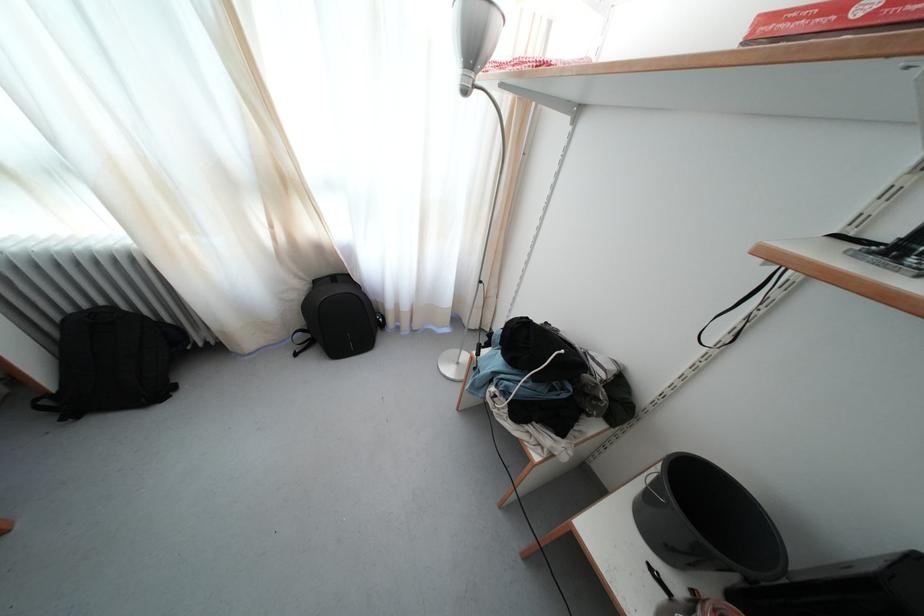
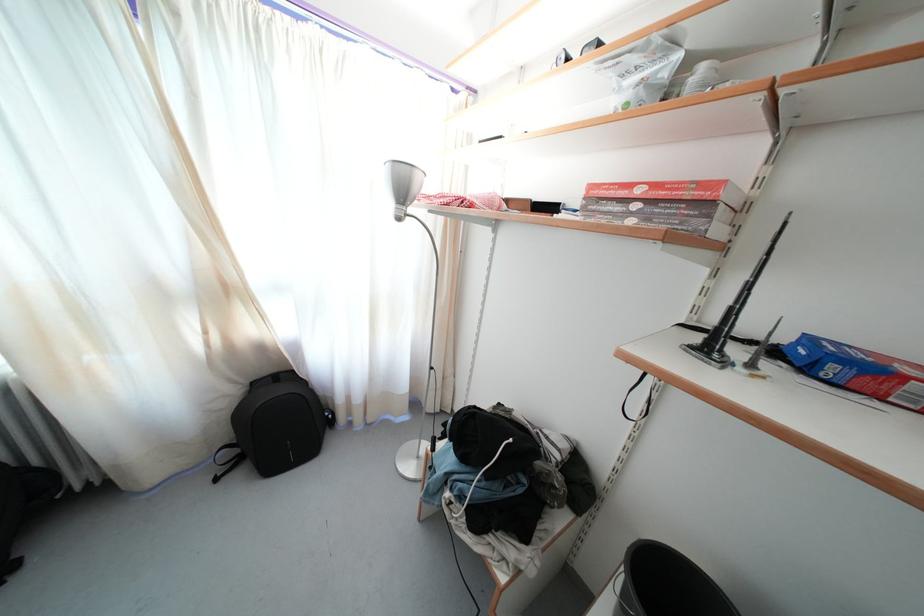
Locate, in the second image, the point that corresponds to point (480, 59) in the first image.

(408, 199)